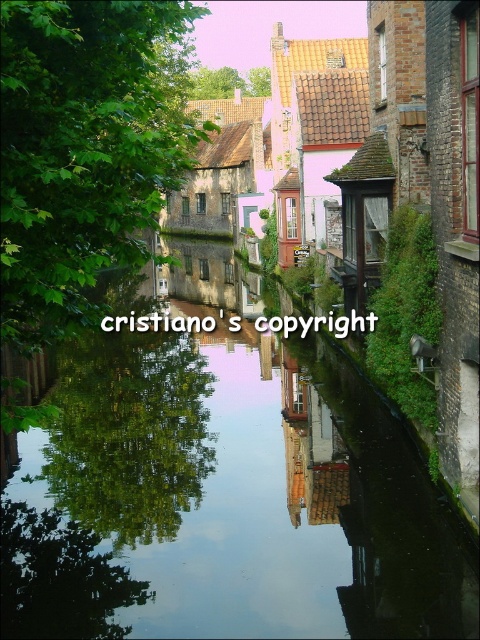
Between green reflective water at center and green leafy tree at center, which one is positioned higher?

green leafy tree at center

Find the location of a particular element. The image size is (480, 640). green reflective water at center is located at coordinates (224, 500).

The width and height of the screenshot is (480, 640). I want to click on green reflective water at center, so click(x=224, y=500).

Is green reflective water at center above green leafy tree at upper center?

No.

Is point (216, 611) farther from camera compared to point (257, 76)?

That is False.

You are a GUI agent. You are given a task and a screenshot of the screen. Output one action in this format:
    pyautogui.click(x=<x>, y=<y>)
    Task: Click on the green reflective water at center
    The width and height of the screenshot is (480, 640).
    Given the screenshot: What is the action you would take?
    pyautogui.click(x=224, y=500)

Which of these two, green leafy tree at center or green leafy tree at upper center, stands shorter?

Standing shorter between the two is green leafy tree at upper center.

Looking at this image, does green leafy tree at center have a larger size compared to green leafy tree at upper center?

Correct, green leafy tree at center is larger in size than green leafy tree at upper center.

Identify the location of green leafy tree at center. The width and height of the screenshot is (480, 640). (84, 147).